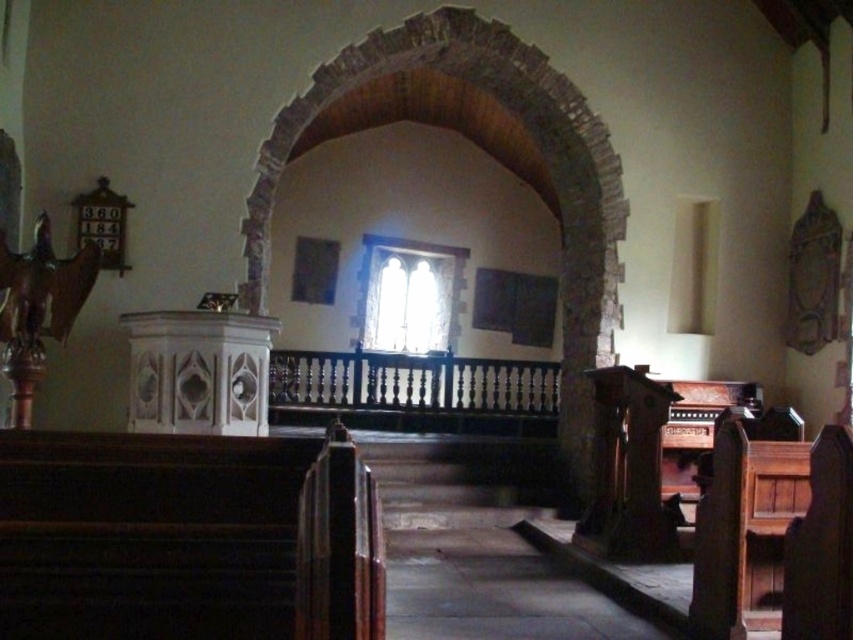
Question: Is the position of brick textured archway at center less distant than that of dark brown polished wood church bench at lower right?

Choices:
 (A) yes
 (B) no

Answer: (B)

Question: Which point appears closest to the camera in this image?

Choices:
 (A) (567, 259)
 (B) (840, 616)

Answer: (B)

Question: Where is brick textured archway at center located in relation to dark brown polished wood church bench at lower right in the image?

Choices:
 (A) above
 (B) below

Answer: (A)

Question: Can you confirm if brick textured archway at center is wider than dark brown polished wood church bench at lower right?

Choices:
 (A) no
 (B) yes

Answer: (A)